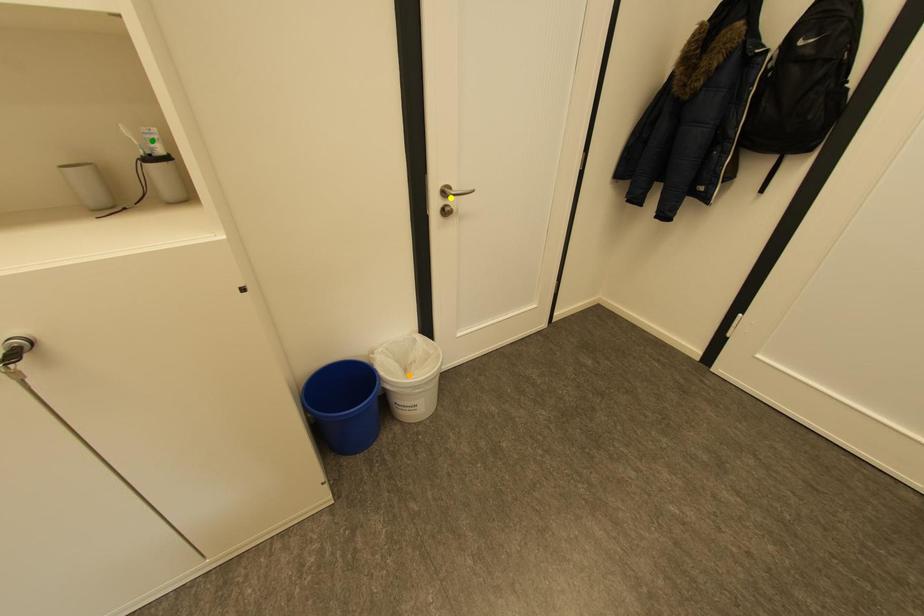
Order these from farthest to nearest:
green point, orange point, yellow point

orange point → yellow point → green point